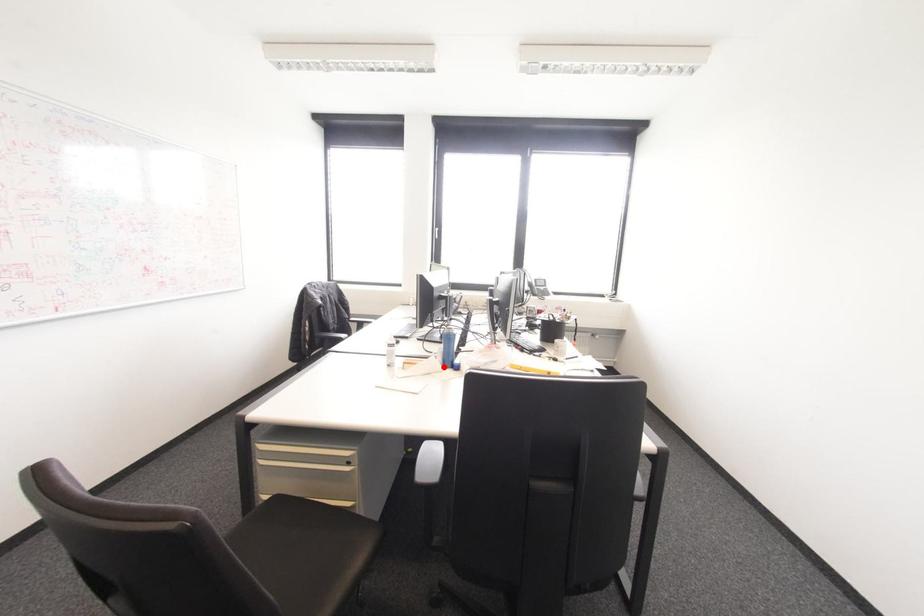
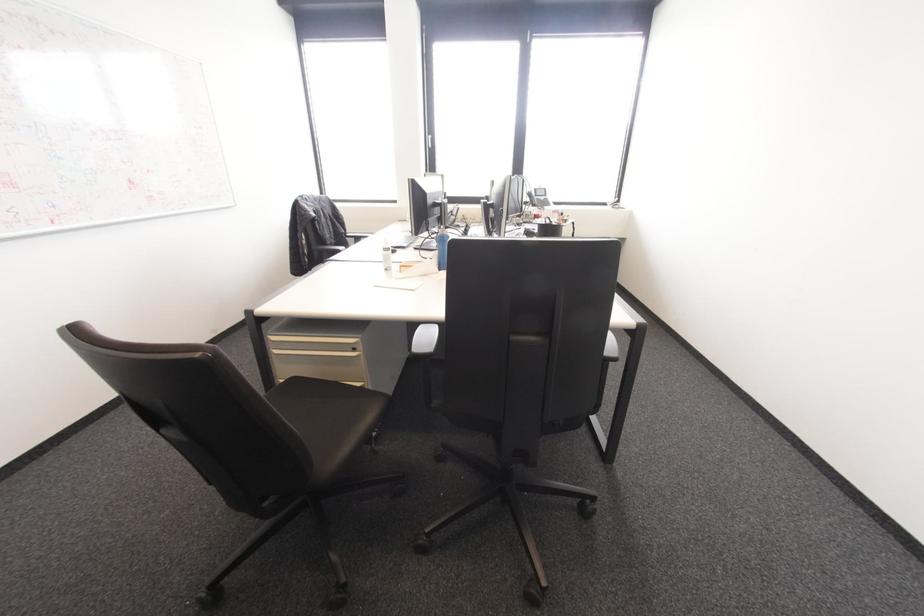
Locate, in the second image, the point that corresponds to the highlighted location in the first image.

(440, 270)